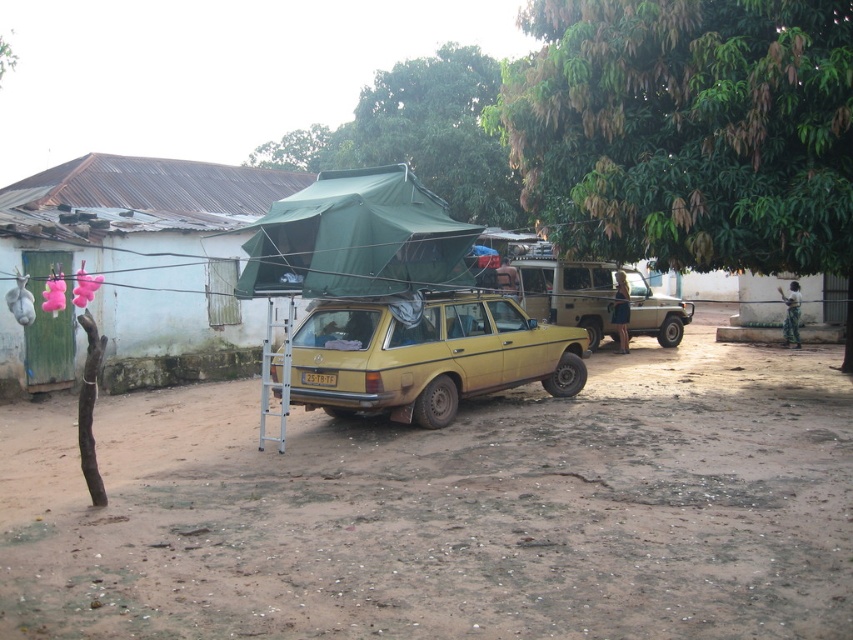
You are a hiker who wants to set up a tent in this area. You have two tents available, the green canvas tent at center and the green fabric tent at upper center. Which tent is closer to you based on their positions in the image?

The green canvas tent at center is closer to you because it is positioned in front of the green fabric tent at upper center.

You are planning to set up a new tent in this scene. The green fabric tent at upper center and the tan matte jeep at center are both in your way. Which object do you need to move first to make space for the new tent?

The green fabric tent at upper center has a larger width than the tan matte jeep at center, so you need to move the green fabric tent at upper center first to make space for the new tent.